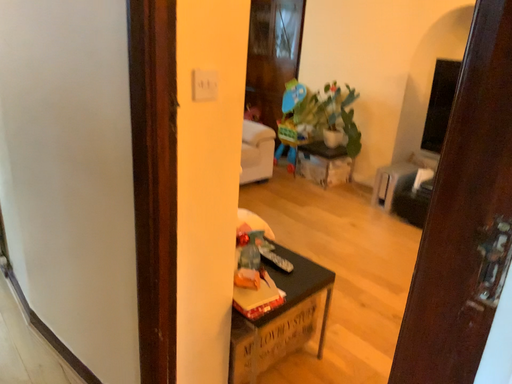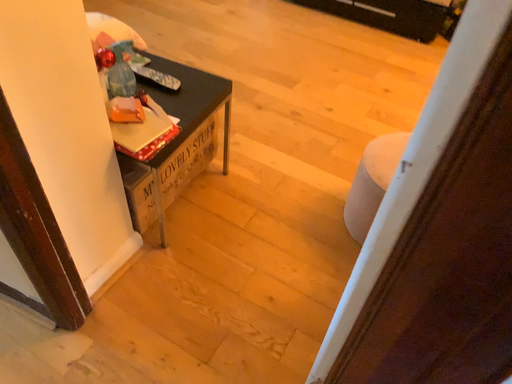
Question: Which way did the camera rotate in the video?

Choices:
 (A) rotated right
 (B) rotated left

Answer: (A)